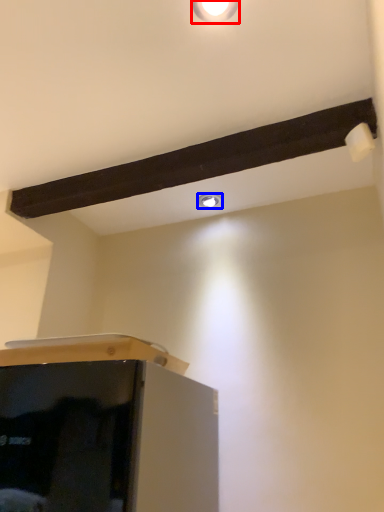
Question: Which object is further to the camera taking this photo, light fixture (highlighted by a red box) or droplight (highlighted by a blue box)?

Choices:
 (A) light fixture
 (B) droplight

Answer: (B)